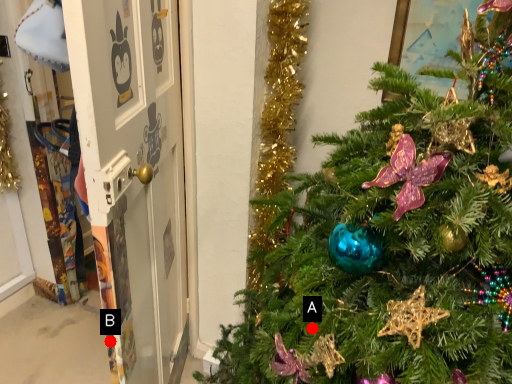
Question: Two points are circled on the image, labeled by A and B beside each circle. Which point is closer to the camera taking this photo?

Choices:
 (A) A is closer
 (B) B is closer

Answer: (A)